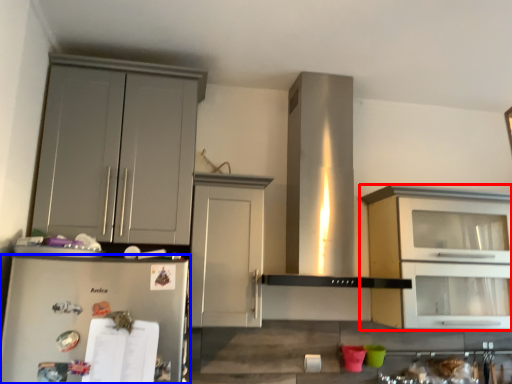
Question: Among these objects, which one is nearest to the camera, cabinetry (highlighted by a red box) or refrigerator (highlighted by a blue box)?

Choices:
 (A) cabinetry
 (B) refrigerator

Answer: (B)